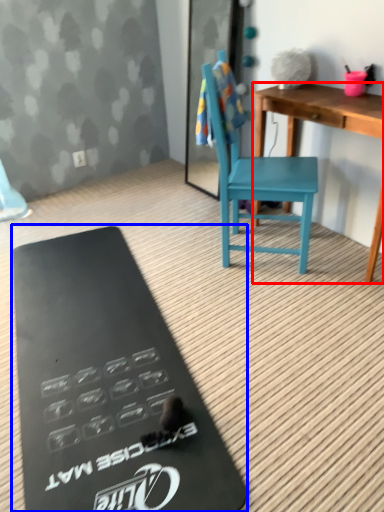
Question: Which point is further to the camera, desk (highlighted by a red box) or clipboard (highlighted by a blue box)?

Choices:
 (A) desk
 (B) clipboard

Answer: (A)